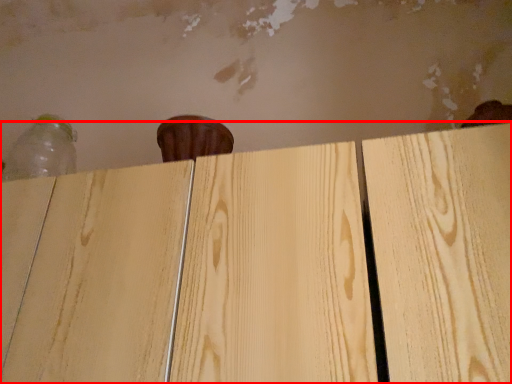
Question: Observing the image, what is the correct spatial positioning of plywood (annotated by the red box) in reference to bottle?

Choices:
 (A) left
 (B) right

Answer: (B)